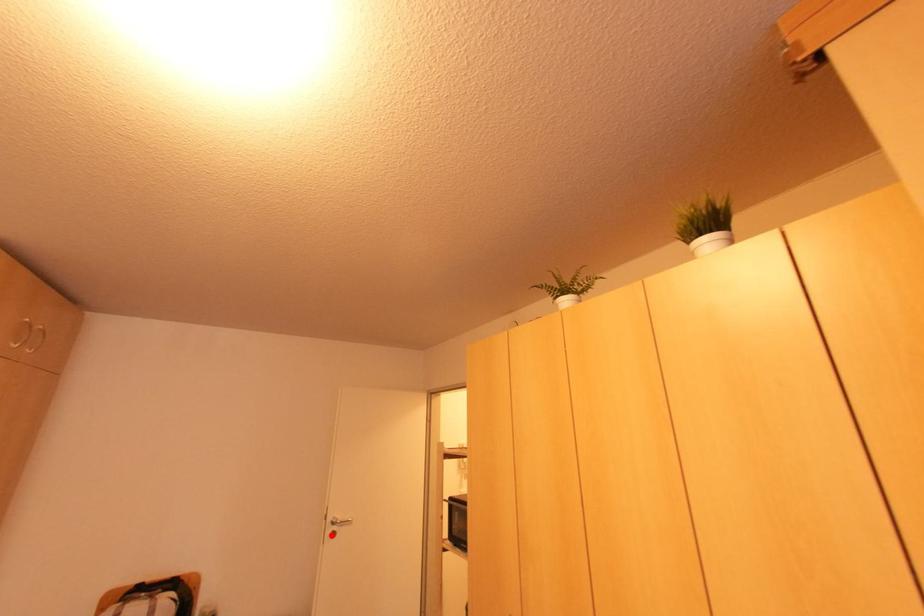
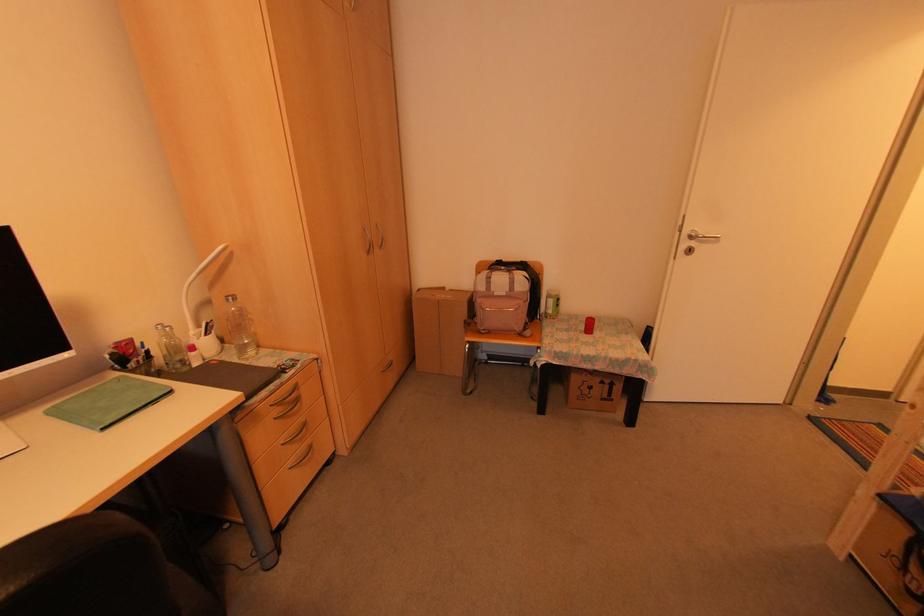
Question: A red point is marked in image1. In image2, is the corresponding 3D point closer to the camera or farther? Reply with the corresponding letter.

Choices:
 (A) The corresponding 3D point is closer.
 (B) The corresponding 3D point is farther.

Answer: (A)